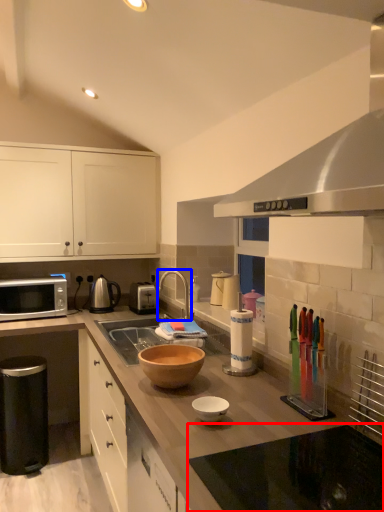
Question: Which object is closer to the camera taking this photo, countertop (highlighted by a red box) or tap (highlighted by a blue box)?

Choices:
 (A) countertop
 (B) tap

Answer: (A)